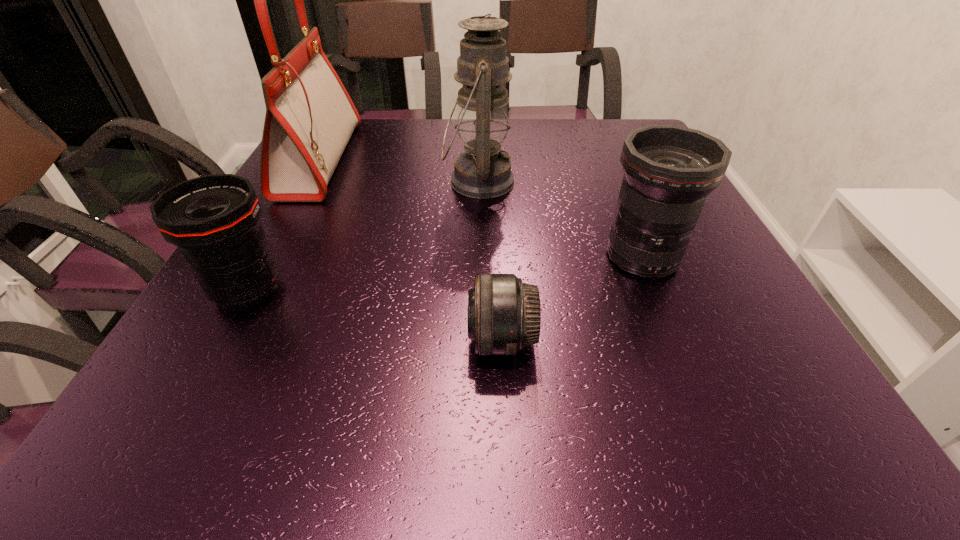
Find the location of a particular element. empty location between the second telephoto lens from right to left and the handbag is located at coordinates (411, 250).

This screenshot has width=960, height=540. Identify the location of free space between the oil lamp and the second telephoto lens from left to right. (490, 261).

Where is `blank region between the second tallest telephoto lens and the oil lamp`? This screenshot has height=540, width=960. blank region between the second tallest telephoto lens and the oil lamp is located at coordinates (363, 236).

Find the location of a particular element. This screenshot has width=960, height=540. vacant region between the oil lamp and the fourth tallest object is located at coordinates point(363,236).

Image resolution: width=960 pixels, height=540 pixels. Identify the location of free space between the second telephoto lens from left to right and the oil lamp. point(490,261).

Where is `vacant space in between the tallest object and the tallest telephoto lens`? Image resolution: width=960 pixels, height=540 pixels. vacant space in between the tallest object and the tallest telephoto lens is located at coordinates (481, 208).

At what (x,y) coordinates should I click in order to perform the action: click on the closest object to the shortest object. Please return your answer as a coordinate pair (x, y). The height and width of the screenshot is (540, 960). Looking at the image, I should click on (669, 170).

The image size is (960, 540). I want to click on object that is the fourth closest to the rightmost object, so click(x=310, y=117).

Identify which telephoto lens is located as the second nearest to the second telephoto lens from left to right. Please provide its 2D coordinates. Your answer should be formatted as a tuple, i.e. [(x, y)], where the tuple contains the x and y coordinates of a point satisfying the conditions above.

[(214, 219)]

Where is `telephoto lens that stands as the closest to the second shortest telephoto lens`? This screenshot has width=960, height=540. telephoto lens that stands as the closest to the second shortest telephoto lens is located at coordinates (504, 314).